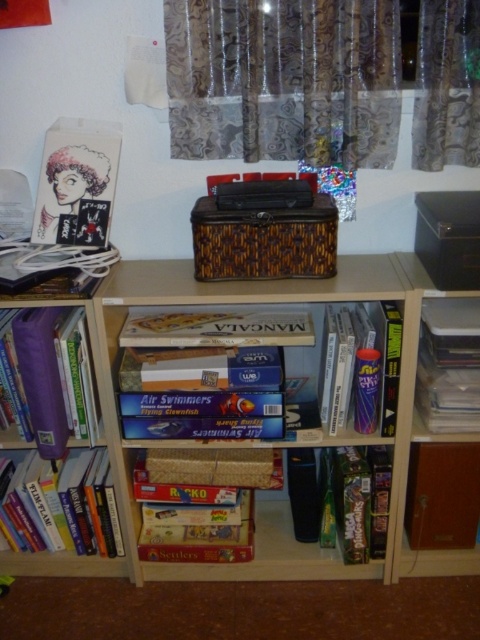
In the scene shown: You are a librarian who needs to place a 70 cm wide decorative shelf divider between the purple matte book at lower left and the white plastic books at right. Will the divider fit between them without overlapping?

The distance between the purple matte book at lower left and the white plastic books at right is 82.37 centimeters. Since the divider is 70 cm wide, it will fit as there is enough space between them.

In the scene shown: You are organizing a library and need to place the purple matte book at lower left and the white plastic books at right onto a shelf. If the shelf has limited space, which book should you place first to maximize space efficiency?

The white plastic books at right should be placed first since they are narrower than the purple matte book at lower left, allowing more space for the wider book afterward.

You are organizing a library and need to place a new book that is 12 cm tall. You have two options on the shelf where the matte purple book at center and white plastic books at right are located. Which existing book should you compare the new book to determine if it will fit?

The matte purple book at center is taller than the white plastic books at right. Since the new book is 12 cm tall, you should compare it to the white plastic books at right first. If it is shorter or equal in height, it can fit there. If not, check the space for the taller matte purple book at center.